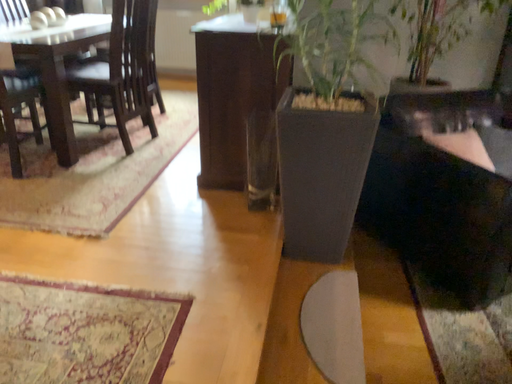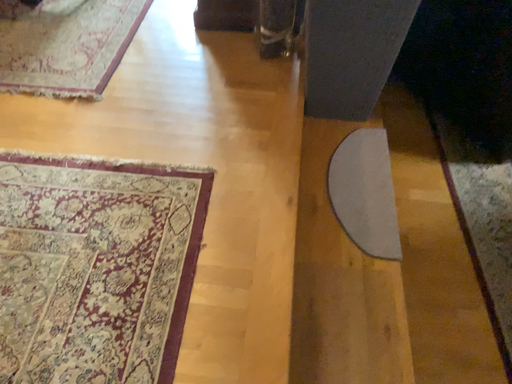
Question: Which way did the camera rotate in the video?

Choices:
 (A) rotated upward
 (B) rotated downward

Answer: (B)